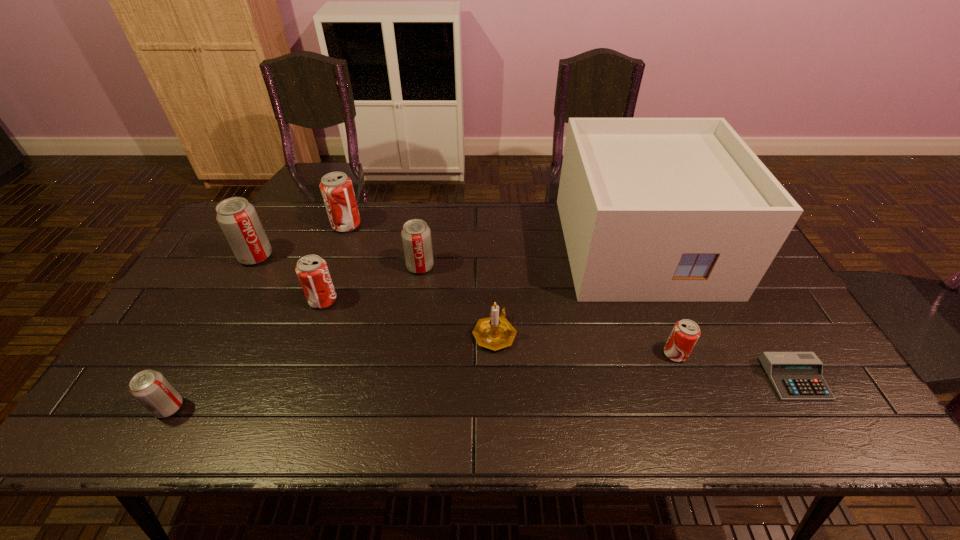
Identify the location of soda can that is the third closest to the sixth object from left to right. The width and height of the screenshot is (960, 540). (312, 271).

Select which soda can appears as the closest to the second nearest pink soda can. Please provide its 2D coordinates. Your answer should be formatted as a tuple, i.e. [(x, y)], where the tuple contains the x and y coordinates of a point satisfying the conditions above.

[(237, 218)]

Select which pink soda can appears as the second closest to the biggest gray soda can. Please provide its 2D coordinates. Your answer should be formatted as a tuple, i.e. [(x, y)], where the tuple contains the x and y coordinates of a point satisfying the conditions above.

[(312, 271)]

Locate which pink soda can is the closest to the biggest pink soda can. Please provide its 2D coordinates. Your answer should be formatted as a tuple, i.e. [(x, y)], where the tuple contains the x and y coordinates of a point satisfying the conditions above.

[(312, 271)]

In order to click on gray soda can that is the closest to the gray box in this screenshot , I will do `click(416, 236)`.

Select which gray soda can is the closest to the rightmost gray soda can. Please provide its 2D coordinates. Your answer should be formatted as a tuple, i.e. [(x, y)], where the tuple contains the x and y coordinates of a point satisfying the conditions above.

[(237, 218)]

Where is `vacant point that satisfies the following two spatial constraints: 1. on the front side of the third nearest soda can; 2. on the right side of the biggest gray soda can`? vacant point that satisfies the following two spatial constraints: 1. on the front side of the third nearest soda can; 2. on the right side of the biggest gray soda can is located at coordinates (232, 300).

The height and width of the screenshot is (540, 960). I want to click on blank area in the image that satisfies the following two spatial constraints: 1. on the back side of the biggest gray soda can; 2. on the right side of the biggest pink soda can, so click(x=273, y=225).

Where is `free space that satisfies the following two spatial constraints: 1. on the front side of the biggest gray soda can; 2. on the right side of the fifth farthest soda can`? free space that satisfies the following two spatial constraints: 1. on the front side of the biggest gray soda can; 2. on the right side of the fifth farthest soda can is located at coordinates (204, 354).